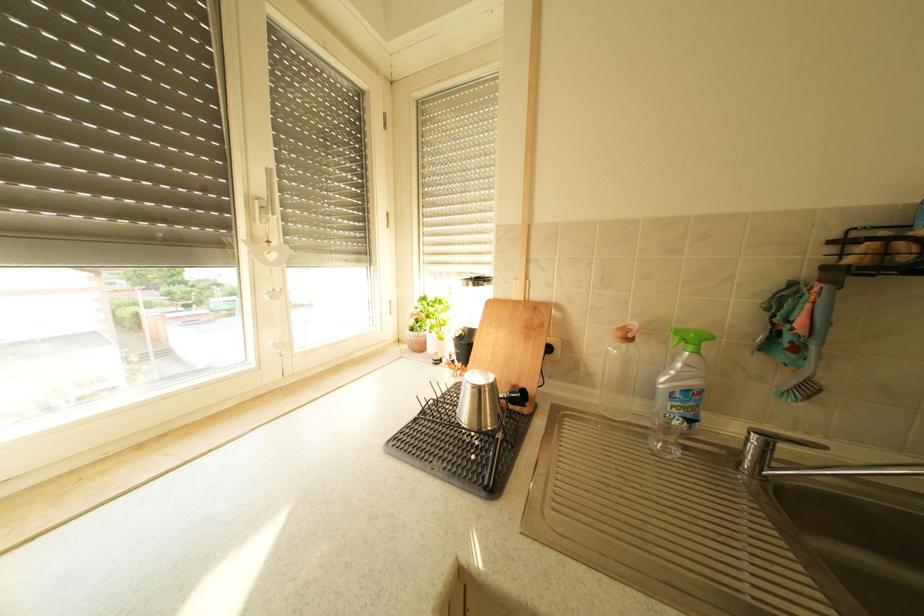
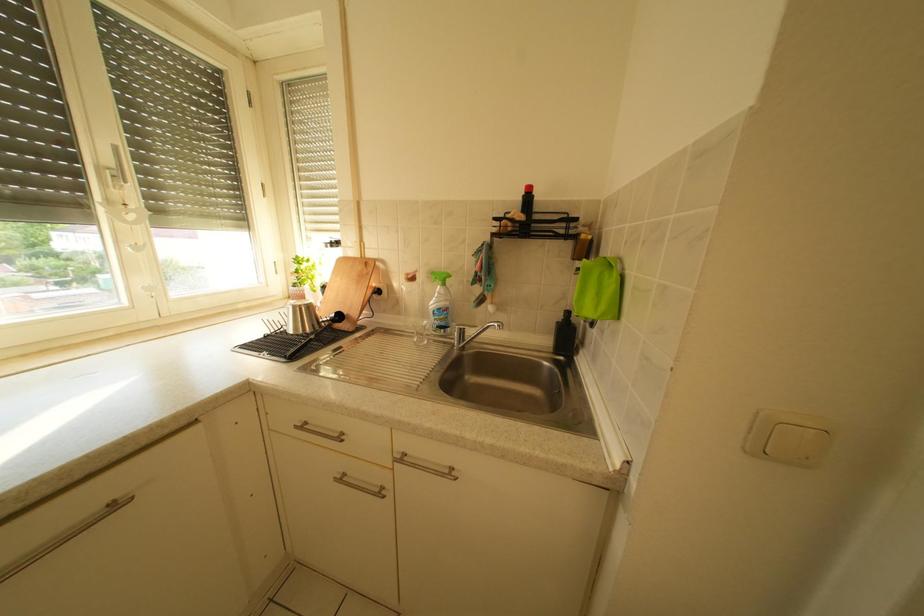
What movement of the cameraman would produce the second image?

The movement direction of the cameraman is right, backward.